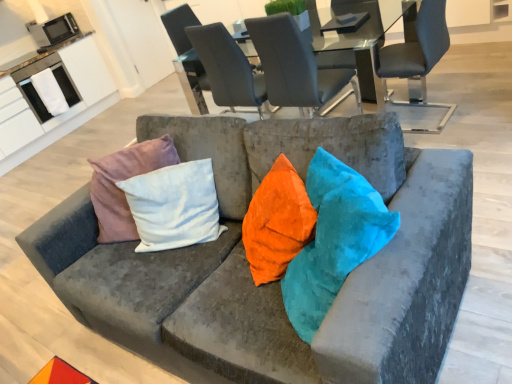
Question: Is metallic microwave at upper left, the first appliance from the top, thinner than matte gray chair at upper right, which is the 1th chair in right-to-left order?

Choices:
 (A) yes
 (B) no

Answer: (A)

Question: Can you confirm if metallic microwave at upper left, positioned as the second appliance in bottom-to-top order, is taller than matte gray chair at upper right, which is the 1th chair in right-to-left order?

Choices:
 (A) yes
 (B) no

Answer: (B)

Question: Is metallic microwave at upper left, positioned as the second appliance in bottom-to-top order, closer to the viewer compared to matte gray chair at upper right, marked as the 4th chair in a left-to-right arrangement?

Choices:
 (A) no
 (B) yes

Answer: (A)

Question: Can you confirm if metallic microwave at upper left, the first appliance from the top, is shorter than matte gray chair at upper right, which is the 1th chair in right-to-left order?

Choices:
 (A) no
 (B) yes

Answer: (B)

Question: Is metallic microwave at upper left, positioned as the second appliance in bottom-to-top order, at the right side of matte gray chair at upper right, which is the 1th chair in right-to-left order?

Choices:
 (A) no
 (B) yes

Answer: (A)

Question: Visually, is matte gray chair at upper right, which is the 1th chair in right-to-left order, positioned to the left or to the right of white towel at upper left, the second appliance viewed from the top?

Choices:
 (A) left
 (B) right

Answer: (B)

Question: Considering the positions of point tap(415, 99) and point tap(74, 100), is point tap(415, 99) closer or farther from the camera than point tap(74, 100)?

Choices:
 (A) closer
 (B) farther

Answer: (A)

Question: In terms of height, does matte gray chair at upper right, which is the 1th chair in right-to-left order, look taller or shorter compared to white towel at upper left, acting as the first appliance starting from the bottom?

Choices:
 (A) tall
 (B) short

Answer: (A)

Question: Considering their positions, is matte gray chair at upper right, which is the 1th chair in right-to-left order, located in front of or behind white towel at upper left, acting as the first appliance starting from the bottom?

Choices:
 (A) front
 (B) behind

Answer: (A)

Question: Relative to white towel at upper left, acting as the first appliance starting from the bottom, is matte gray chair at upper center, which is the 4th chair from right to left, in front or behind?

Choices:
 (A) behind
 (B) front

Answer: (B)

Question: Is point (180, 21) closer or farther from the camera than point (30, 82)?

Choices:
 (A) closer
 (B) farther

Answer: (A)

Question: From their relative heights in the image, would you say matte gray chair at upper center, which is the 4th chair from right to left, is taller or shorter than white towel at upper left, the second appliance viewed from the top?

Choices:
 (A) short
 (B) tall

Answer: (B)

Question: Is matte gray chair at upper center, which is the 4th chair from right to left, situated inside white towel at upper left, the second appliance viewed from the top, or outside?

Choices:
 (A) inside
 (B) outside

Answer: (B)

Question: From the image's perspective, is white towel at upper left, the second appliance viewed from the top, above or below matte gray chair at upper center, which is the 1th chair in left-to-right order?

Choices:
 (A) above
 (B) below

Answer: (A)

Question: From a real-world perspective, relative to matte gray chair at upper center, which is the 1th chair in left-to-right order, is white towel at upper left, the second appliance viewed from the top, vertically above or below?

Choices:
 (A) above
 (B) below

Answer: (A)